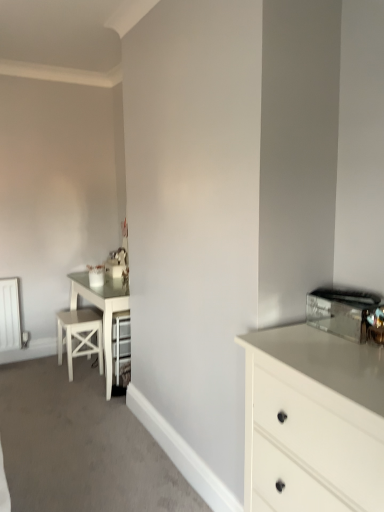
You are a GUI agent. You are given a task and a screenshot of the screen. Output one action in this format:
    pyautogui.click(x=<x>, y=<y>)
    Task: Click on the free space on the front side of shiny metallic toaster at upper right
    Image resolution: width=384 pixels, height=512 pixels.
    Given the screenshot: What is the action you would take?
    (344, 350)